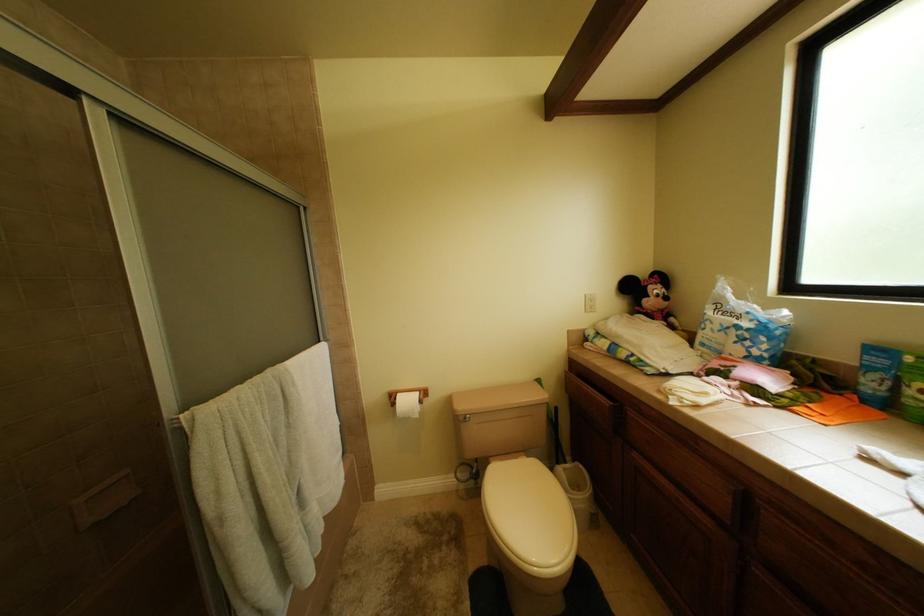
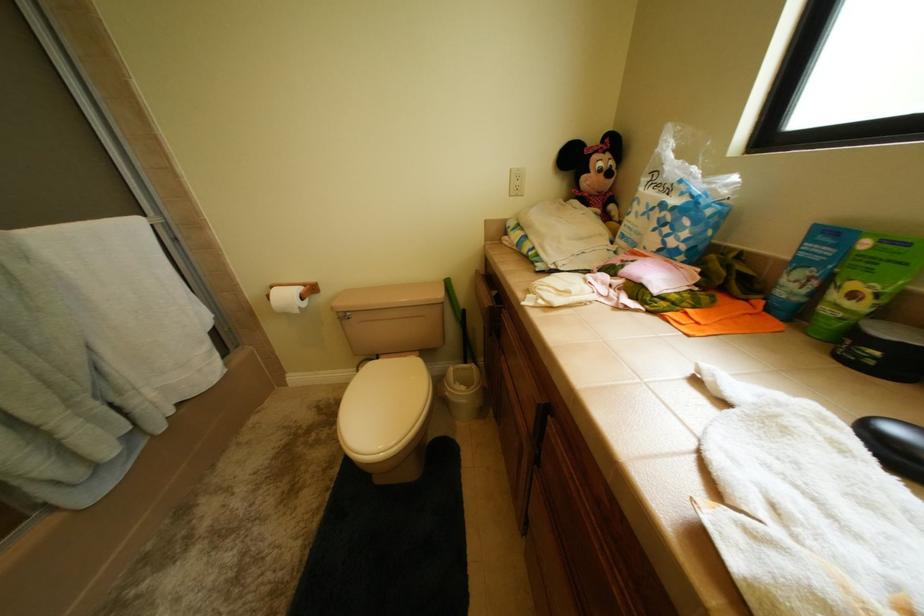
Question: Based on the continuous images, in which direction is the camera rotating? Reply with the corresponding letter.

Choices:
 (A) Left
 (B) Right
 (C) Up
 (D) Down

Answer: (D)